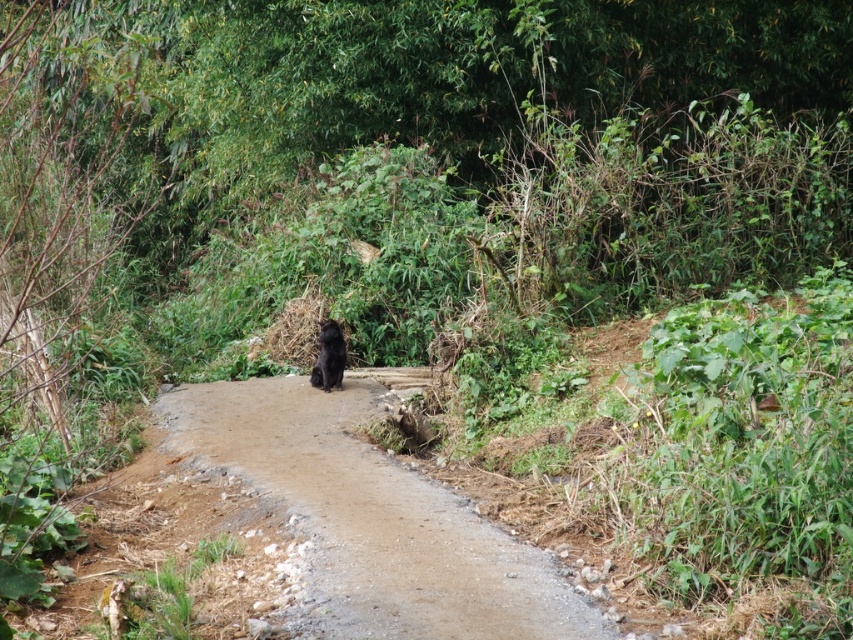
Question: Can you confirm if dirt road at center is smaller than black furry dog at center?

Choices:
 (A) no
 (B) yes

Answer: (B)

Question: Which point is farther to the camera?

Choices:
 (A) (329, 362)
 (B) (440, 540)

Answer: (A)

Question: Can you confirm if dirt road at center is smaller than black furry dog at center?

Choices:
 (A) yes
 (B) no

Answer: (A)

Question: Does dirt road at center have a greater width compared to black furry dog at center?

Choices:
 (A) yes
 (B) no

Answer: (A)